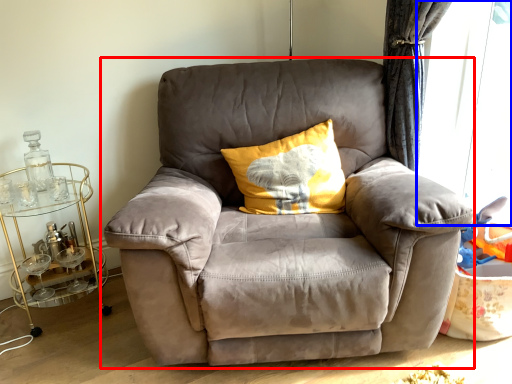
Question: Among these objects, which one is farthest to the camera, chair (highlighted by a red box) or window screen (highlighted by a blue box)?

Choices:
 (A) chair
 (B) window screen

Answer: (B)